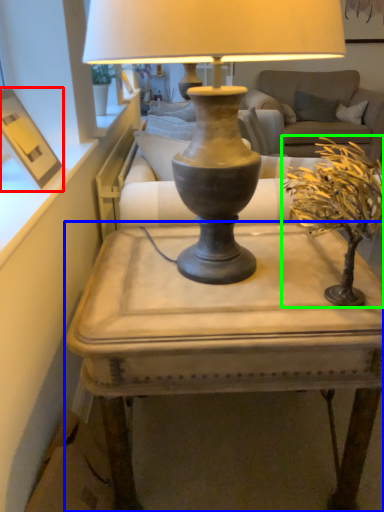
Question: Which object is the closest to the picture frame (highlighted by a red box)? Choose among these: table (highlighted by a blue box) or houseplant (highlighted by a green box).

Choices:
 (A) table
 (B) houseplant

Answer: (A)